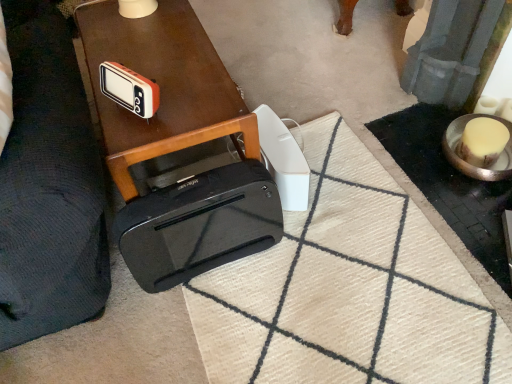
Locate an element on the screen. The width and height of the screenshot is (512, 384). vacant space in front of white plastic remote control at center, acting as the 1th gadget starting from the right is located at coordinates (309, 243).